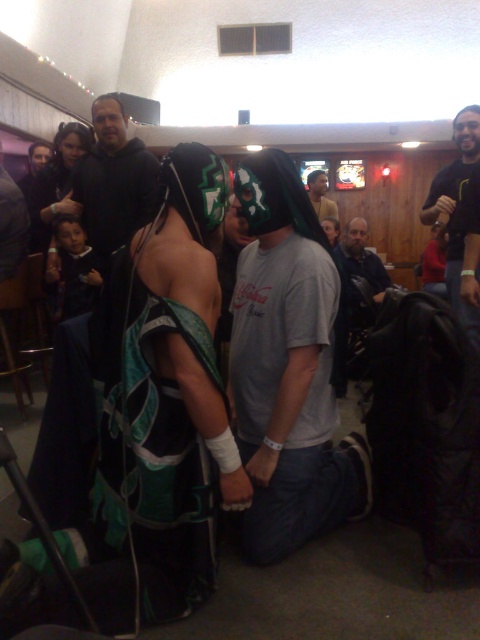
What is the color of the clothing item located at the coordinates point (287,365)?

The clothing item at point (287,365) is a white cotton t shirt.